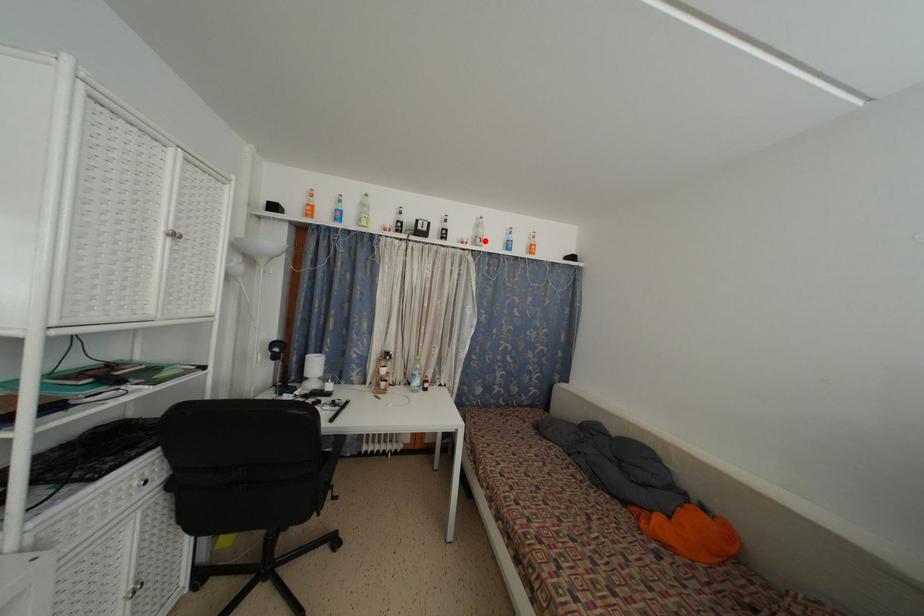
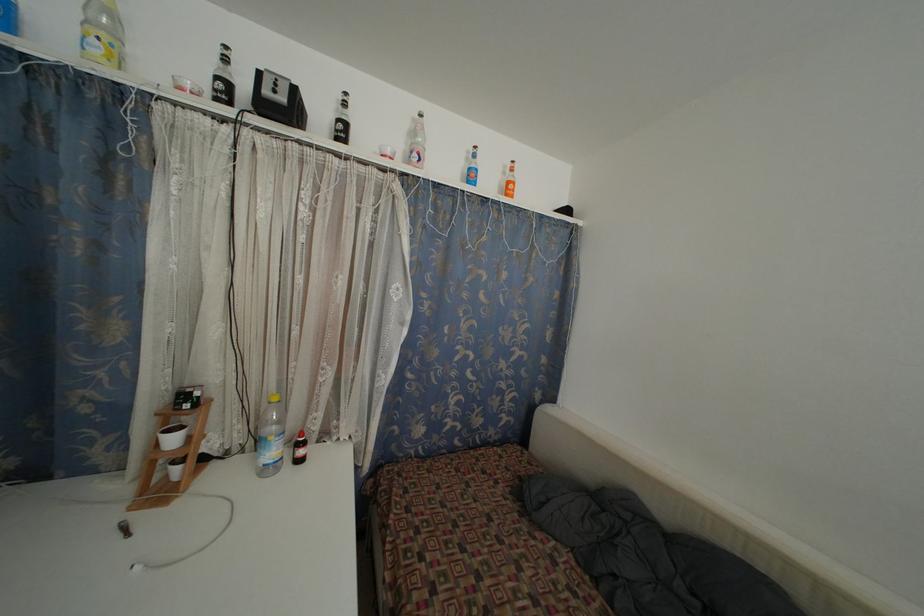
Where in the second image is the point corresponding to the highlighted location from the first image?

(423, 154)